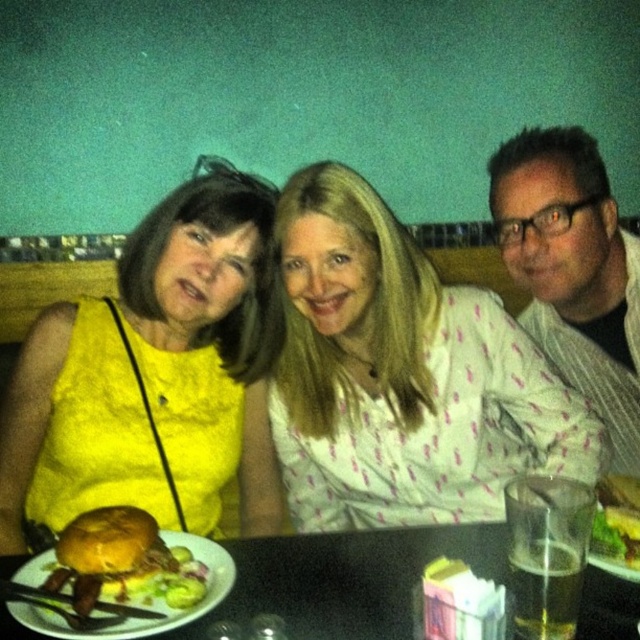
Question: Does white dotted shirt at center appear over yellow fabric dress at left?

Choices:
 (A) yes
 (B) no

Answer: (A)

Question: Is yellow fabric dress at left below satin white shirt at center?

Choices:
 (A) no
 (B) yes

Answer: (B)

Question: Can you confirm if white dotted shirt at center is positioned to the left of slightly toasted bun at center?

Choices:
 (A) yes
 (B) no

Answer: (B)

Question: Which point appears closest to the camera in this image?

Choices:
 (A) (621, 280)
 (B) (352, 188)
 (C) (385, 580)
 (D) (136, 552)

Answer: (D)

Question: Which object is farther from the camera taking this photo?

Choices:
 (A) black plastic table at lower center
 (B) satin white shirt at center

Answer: (B)

Question: Which of the following is the farthest from the observer?

Choices:
 (A) slightly toasted bun at center
 (B) yellow fabric dress at left
 (C) white dotted shirt at center

Answer: (C)